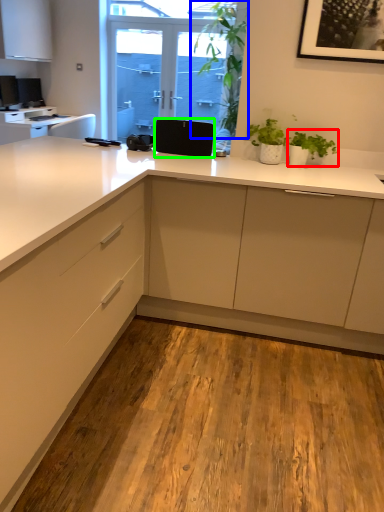
Question: Which object is the closest to the houseplant (highlighted by a red box)? Choose among these: plant (highlighted by a blue box) or speaker (highlighted by a green box).

Choices:
 (A) plant
 (B) speaker

Answer: (B)